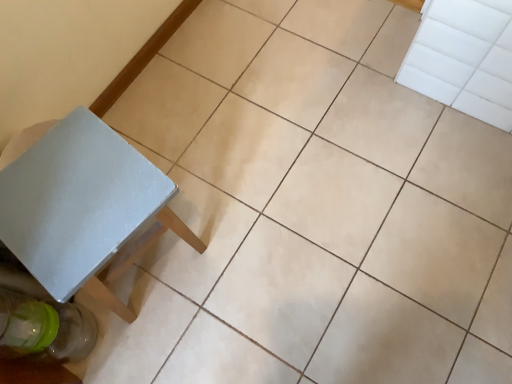
Locate an element on the screen. The height and width of the screenshot is (384, 512). free space to the right of white matte table at lower left is located at coordinates point(236,244).